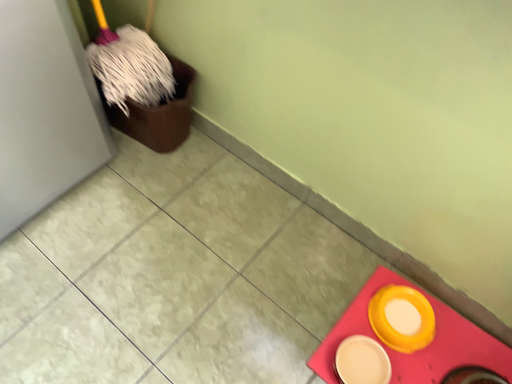
You are a GUI agent. You are given a task and a screenshot of the screen. Output one action in this format:
    pyautogui.click(x=<x>, y=<y>)
    Task: Click on the vacant area on the back side of matte yellow plate at lower right, which ranks as the 2th tableware in right-to-left order
    The height and width of the screenshot is (384, 512).
    Given the screenshot: What is the action you would take?
    pyautogui.click(x=340, y=294)